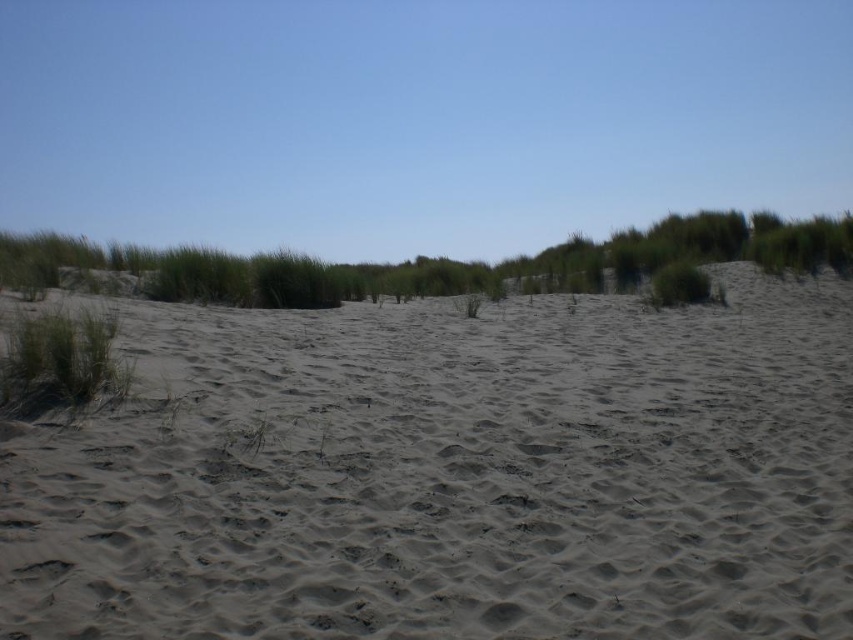
Is point (846, 634) farther from camera compared to point (100, 321)?

That is False.

Who is shorter, smooth sand at center or green grass at left?

green grass at left is shorter.

Locate an element on the screen. This screenshot has height=640, width=853. smooth sand at center is located at coordinates (450, 474).

This screenshot has width=853, height=640. What are the coordinates of `smooth sand at center` in the screenshot? It's located at (450, 474).